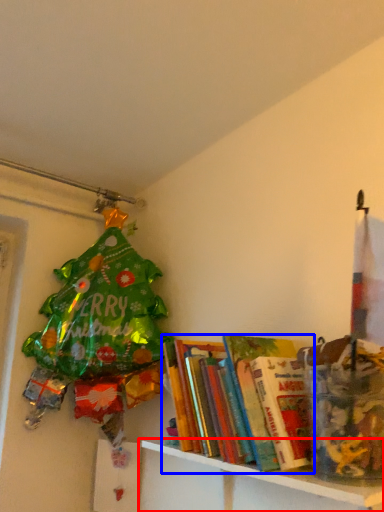
Question: Which of the following is the farthest to the observer, shelf (highlighted by a red box) or book (highlighted by a blue box)?

Choices:
 (A) shelf
 (B) book

Answer: (B)